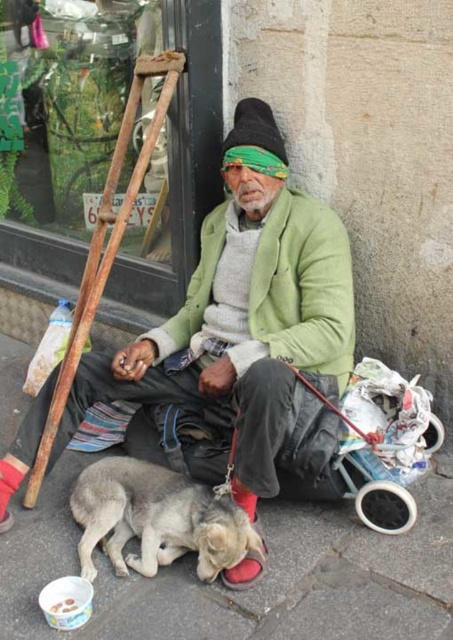
You are a delivery person who needs to place a small package between the green knitted jacket at center and the fuzzy gray dog at lower left. Can you fit the package in the space between them without moving either object?

The green knitted jacket at center is wider than the fuzzy gray dog at lower left, so there is enough space between them to place the small package without moving either object.

You are a delivery person who needs to place a package on the gray concrete pavement at lower center. However, there is a green knitted jacket at center in the way. Can you move the jacket to access the pavement?

The gray concrete pavement at lower center is behind the green knitted jacket at center, so you can move the green knitted jacket at center to access the pavement.

Please provide the coordinates of the green knitted jacket at center in the image. The coordinates should be in the format of a point with two decimal places, like this example format point 0.5,0.5. Please answer with the exact coordinates from the description. The answer should be in the format of point followed by the coordinates in parentheses, like point 0.491,0.539. Do not add any extra information or explanation.

point (244, 314)